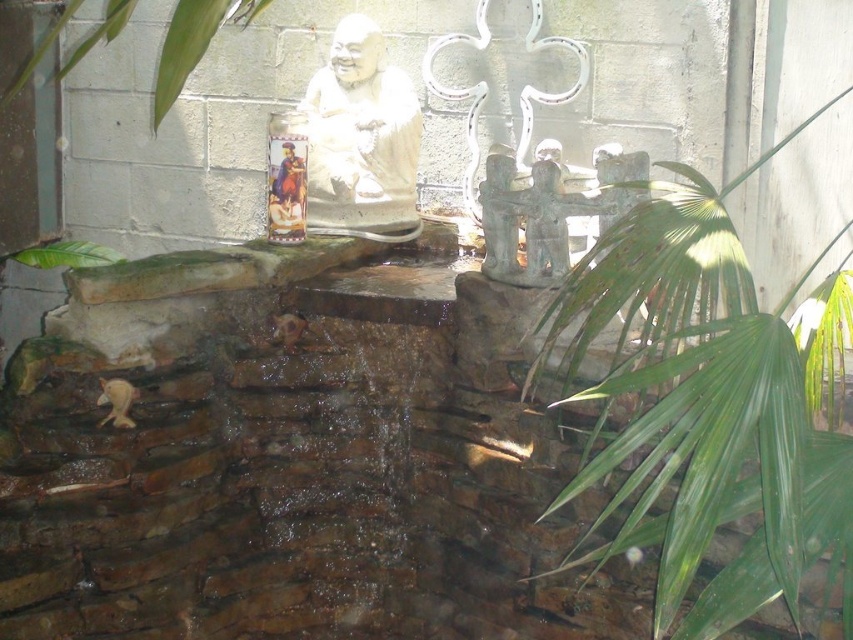
Can you confirm if white stone statue at center is bigger than green leafy plant at left?

Correct, white stone statue at center is larger in size than green leafy plant at left.

Can you confirm if white stone statue at center is taller than green leafy plant at left?

Yes, white stone statue at center is taller than green leafy plant at left.

Where is `white stone statue at center`? The width and height of the screenshot is (853, 640). white stone statue at center is located at coordinates (361, 140).

Between point (379, 76) and point (210, 3), which one is positioned in front?

Point (210, 3) is in front.

Between white stone statue at center and green leafy plant at upper left, which one appears on the right side from the viewer's perspective?

Positioned to the right is white stone statue at center.

Who is more distant from viewer, [344,48] or [113,8]?

Point [344,48]

The width and height of the screenshot is (853, 640). Find the location of `white stone statue at center`. white stone statue at center is located at coordinates (361, 140).

Identify the location of green leafy plant at upper right. click(692, 372).

Is point (628, 390) farther from camera compared to point (393, 225)?

That is False.

Who is more distant from viewer, (741, 433) or (350, 96)?

Point (350, 96)

Image resolution: width=853 pixels, height=640 pixels. I want to click on green leafy plant at upper right, so click(692, 372).